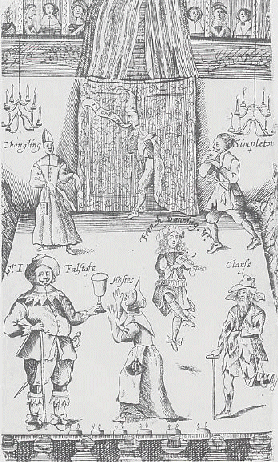
Locate an element on the screen. candle flames is located at coordinates (34, 89), (11, 85), (5, 90), (244, 88), (236, 96), (268, 94).